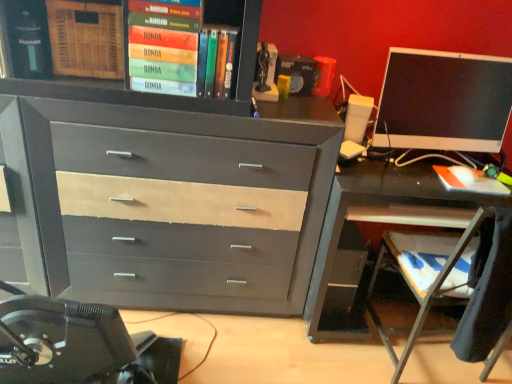
Question: From a real-world perspective, is matte gray wood chest of drawers at center below metallic gray desk at right?

Choices:
 (A) no
 (B) yes

Answer: (A)

Question: Is metallic gray desk at right completely or partially inside matte gray wood chest of drawers at center?

Choices:
 (A) yes
 (B) no

Answer: (B)

Question: Considering the relative sizes of matte gray wood chest of drawers at center and metallic gray desk at right in the image provided, is matte gray wood chest of drawers at center wider than metallic gray desk at right?

Choices:
 (A) no
 (B) yes

Answer: (A)

Question: Would you say matte gray wood chest of drawers at center is outside metallic gray desk at right?

Choices:
 (A) yes
 (B) no

Answer: (A)

Question: Is matte gray wood chest of drawers at center facing away from metallic gray desk at right?

Choices:
 (A) no
 (B) yes

Answer: (A)

Question: Considering their positions, is hardcover book at upper center, acting as the second book starting from the top, located in front of or behind matte black monitor at right?

Choices:
 (A) front
 (B) behind

Answer: (A)

Question: From a real-world perspective, is hardcover book at upper center, acting as the second book starting from the top, physically located above or below matte black monitor at right?

Choices:
 (A) below
 (B) above

Answer: (B)

Question: Considering the positions of point (214, 62) and point (437, 119), is point (214, 62) closer or farther from the camera than point (437, 119)?

Choices:
 (A) farther
 (B) closer

Answer: (B)

Question: From the image's perspective, relative to matte black monitor at right, is hardcover book at upper center, acting as the second book starting from the top, above or below?

Choices:
 (A) above
 (B) below

Answer: (A)

Question: Based on their positions, is matte gray wood chest of drawers at center located to the left or right of wooden at lower right?

Choices:
 (A) right
 (B) left

Answer: (B)

Question: Considering the positions of matte gray wood chest of drawers at center and wooden at lower right in the image, is matte gray wood chest of drawers at center bigger or smaller than wooden at lower right?

Choices:
 (A) small
 (B) big

Answer: (B)

Question: Is point (290, 210) positioned closer to the camera than point (446, 258)?

Choices:
 (A) farther
 (B) closer

Answer: (A)

Question: From the image's perspective, is matte gray wood chest of drawers at center positioned above or below wooden at lower right?

Choices:
 (A) below
 (B) above

Answer: (B)

Question: In terms of width, does matte black monitor at right look wider or thinner when compared to hardcover book at upper center, acting as the second book starting from the top?

Choices:
 (A) thin
 (B) wide

Answer: (A)

Question: From the image's perspective, is matte black monitor at right positioned above or below hardcover book at upper center, arranged as the 2th book when viewed from the left?

Choices:
 (A) above
 (B) below

Answer: (B)